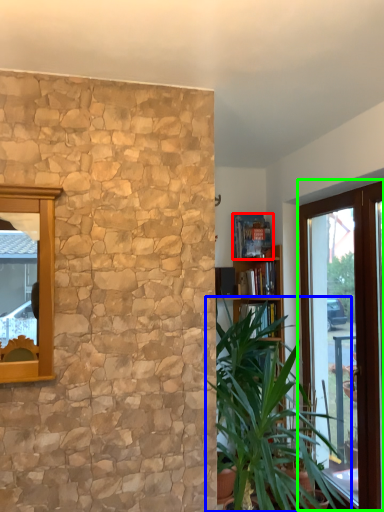
Question: Which object is the farthest from book (highlighted by a red box)? Choose among these: houseplant (highlighted by a blue box) or window (highlighted by a green box).

Choices:
 (A) houseplant
 (B) window

Answer: (A)